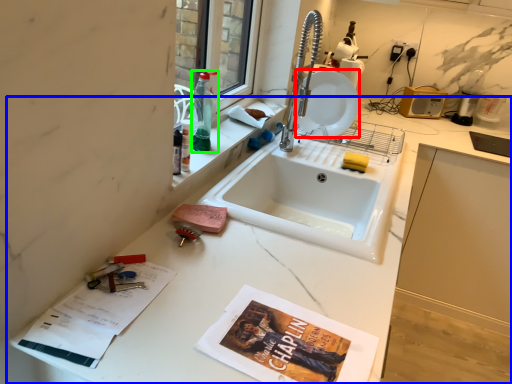
Question: Which is farther away from plate (highlighted by a red box)? countertop (highlighted by a blue box) or bottle (highlighted by a green box)?

Choices:
 (A) countertop
 (B) bottle

Answer: (A)